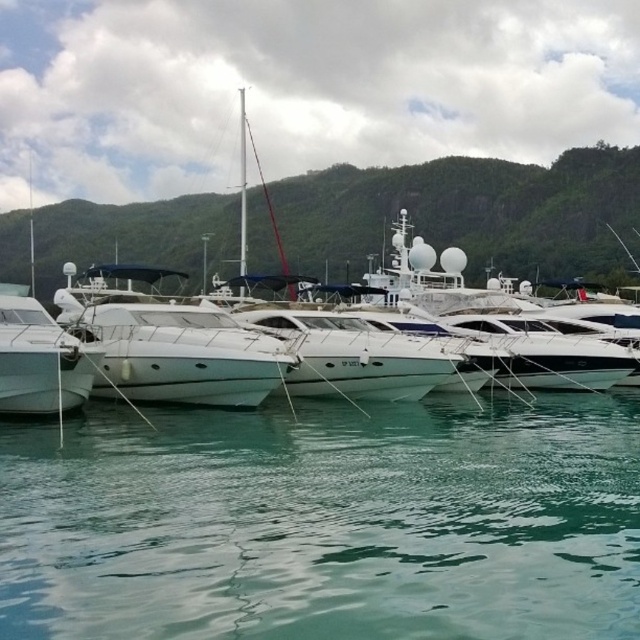
You are standing at the edge of the marina and want to place a floating dock exactly at the location of the green liquid water at lower center. According to the coordinates provided, where should you position the dock?

The green liquid water at lower center is located at point (324, 522), so you should position the dock at those coordinates to place it exactly where the green liquid water at lower center is situated.

You are a photographer planning to capture the white glossy boat at left and the green liquid water at lower center in a single frame. Which object will appear smaller in the photo?

The green liquid water at lower center will appear smaller in the photo because it is shorter than the white glossy boat at left.

You are a tour guide explaining the marina layout to visitors. You point out two specific points in the image. The first point is at coordinates point (410,500) and the second is at point (186,308). Which of these two points is closer to the viewer?

Point (410,500) is in front of point (186,308), so it is closer to the viewer.